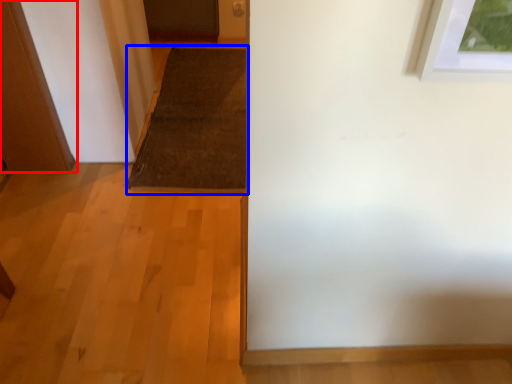
Question: Which object is further to the camera taking this photo, door (highlighted by a red box) or doormat (highlighted by a blue box)?

Choices:
 (A) door
 (B) doormat

Answer: (B)